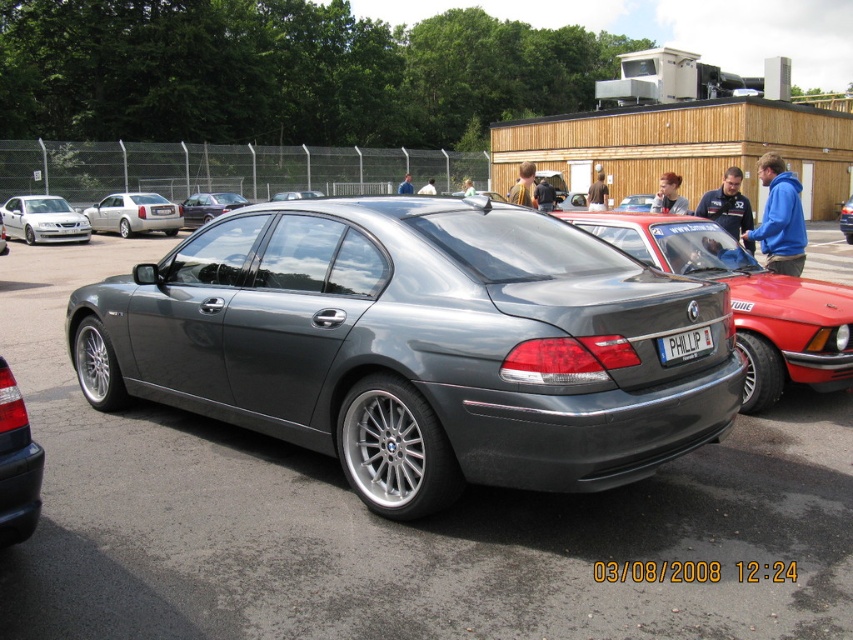
You are a delivery person who needs to place a small box between the black glossy tail light at lower left and the white plastic license plate at center on the BMW sedan. The box requires 10 feet of space. Can you fit it there?

The black glossy tail light at lower left and white plastic license plate at center are 9.81 feet apart, so the box requiring 10 feet of space cannot fit between them.

You are a photographer standing in the parking lot and want to capture a photo that includes both the black glossy tail light at lower left and the white plastic license plate at center. Which object will appear larger in your photo?

The black glossy tail light at lower left will appear larger in the photo because it is closer to the viewer than the white plastic license plate at center.

You are a delivery person needing to park your van, which is 2.2 meters wide. You see the metallic gray car at center and the silver metallic sedan at left in the parking lot. Can your van fit in the space between them?

The metallic gray car at center is wider than the silver metallic sedan at left. Since the space between them may depend on their widths, but without exact measurements, it is uncertain if the van will fit. However, since the metallic gray car at center is wider, the space might be sufficient for your 2.2 meter wide van.